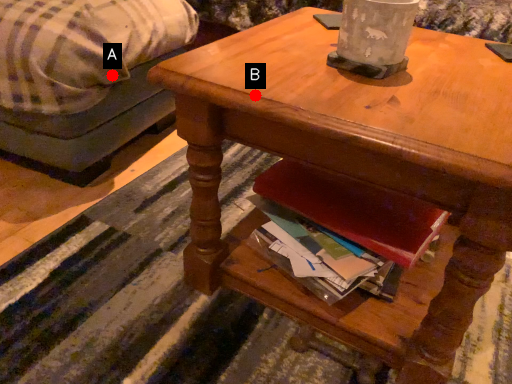
Question: Two points are circled on the image, labeled by A and B beside each circle. Which point is further to the camera?

Choices:
 (A) A is further
 (B) B is further

Answer: (A)